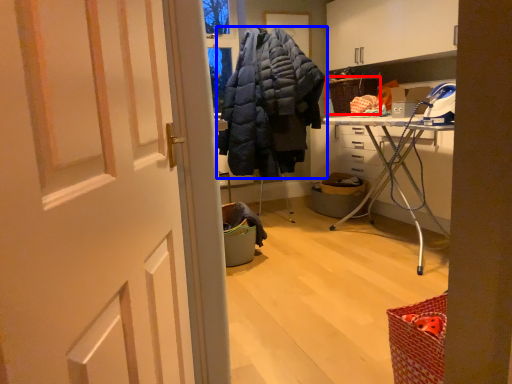
Question: Which object appears farthest to the camera in this image, picnic basket (highlighted by a red box) or jacket (highlighted by a blue box)?

Choices:
 (A) picnic basket
 (B) jacket

Answer: (A)